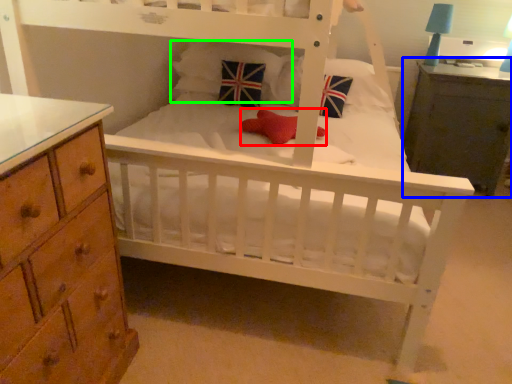
Question: Which is nearer to the toy (highlighted by a red box)? nightstand (highlighted by a blue box) or pillow (highlighted by a green box).

Choices:
 (A) nightstand
 (B) pillow

Answer: (B)